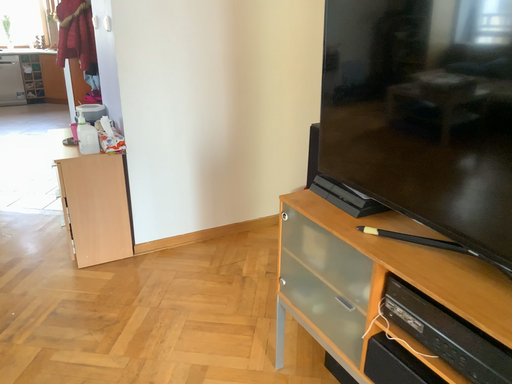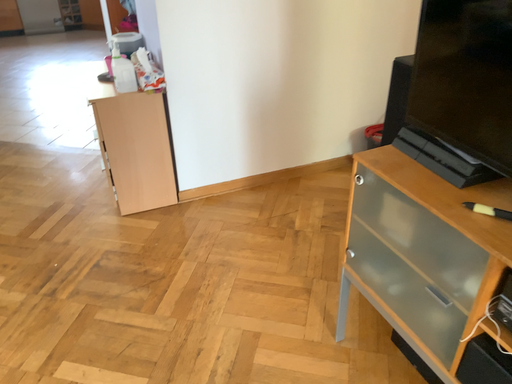
Question: Which way did the camera rotate in the video?

Choices:
 (A) rotated downward
 (B) rotated upward

Answer: (A)